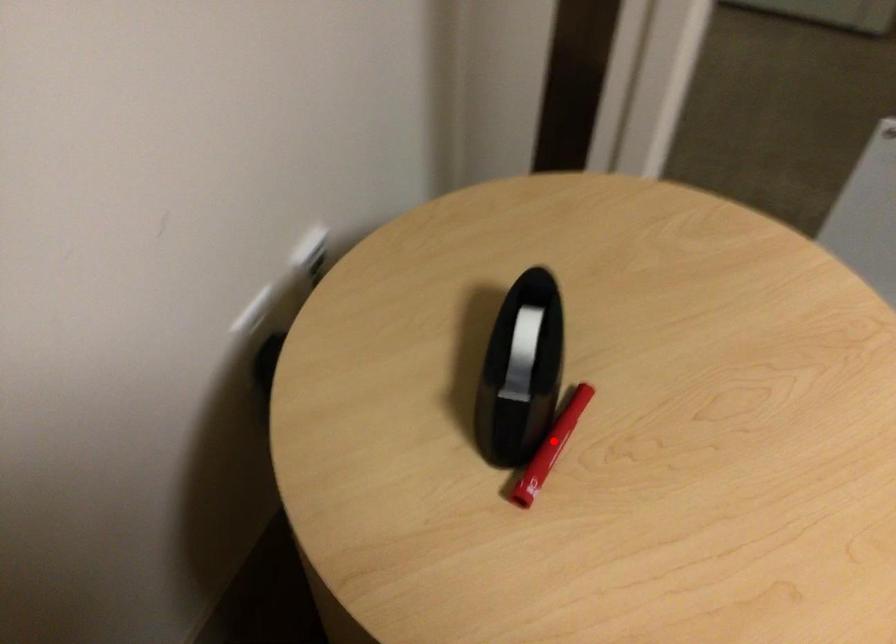
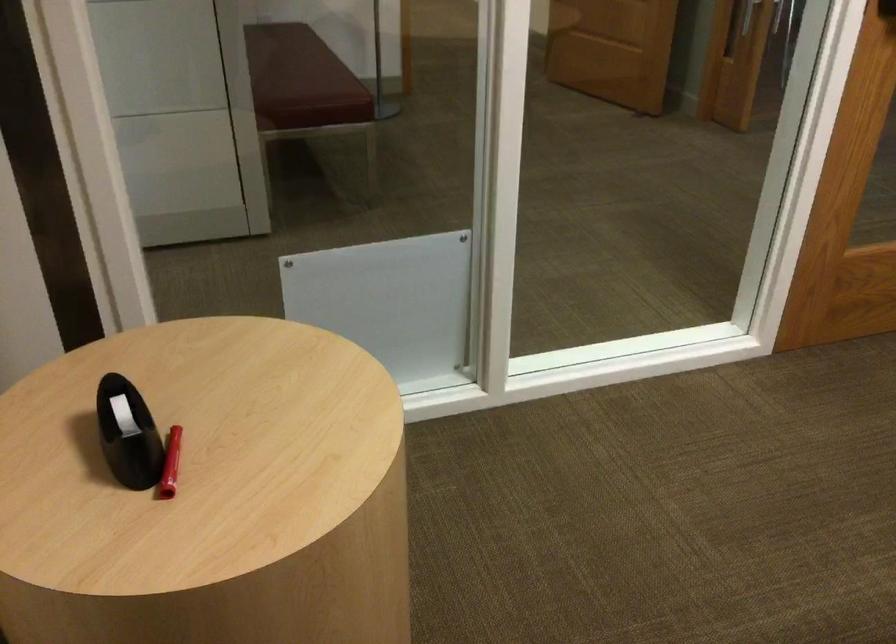
Question: I am providing you with two images of the same scene from different viewpoints. Image1 has a red point marked. In image2, the corresponding 3D location appears at what relative position? Reply with the corresponding letter.

Choices:
 (A) Closer
 (B) Farther

Answer: (B)